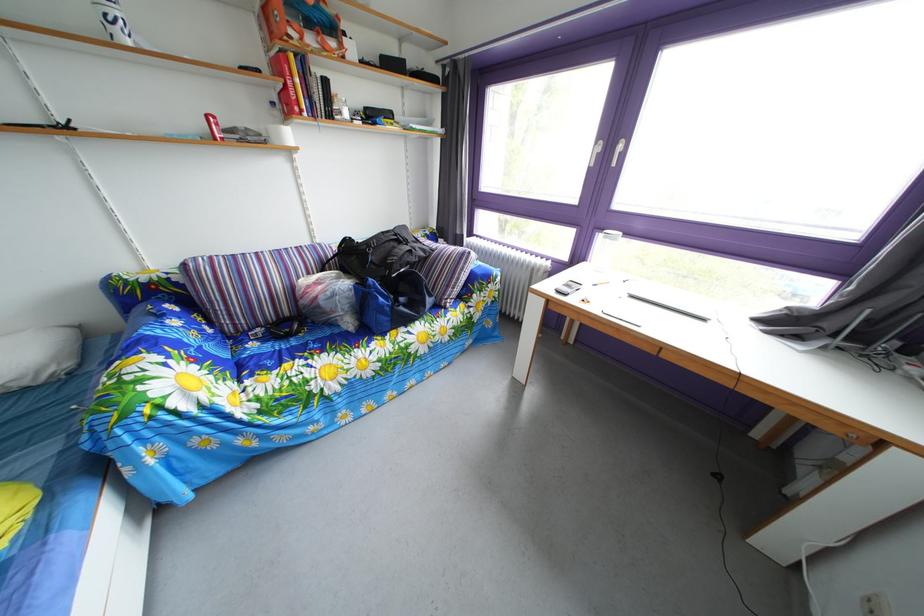
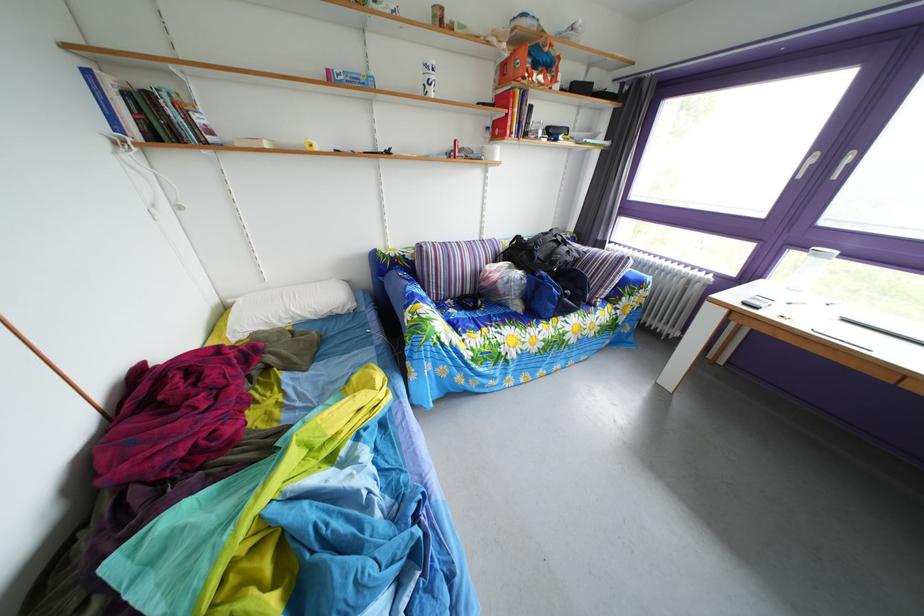
Where in the second image is the point corresponding to the point at 163,326 from the first image?

(417, 290)